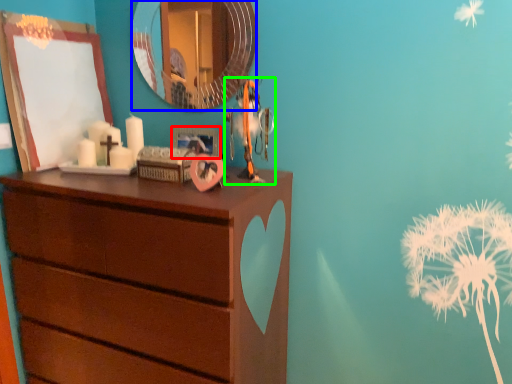
Question: Which object is positioned closest to picture frame (highlighted by a red box)? Select from mirror (highlighted by a blue box) and toy (highlighted by a green box).

Choices:
 (A) mirror
 (B) toy

Answer: (B)